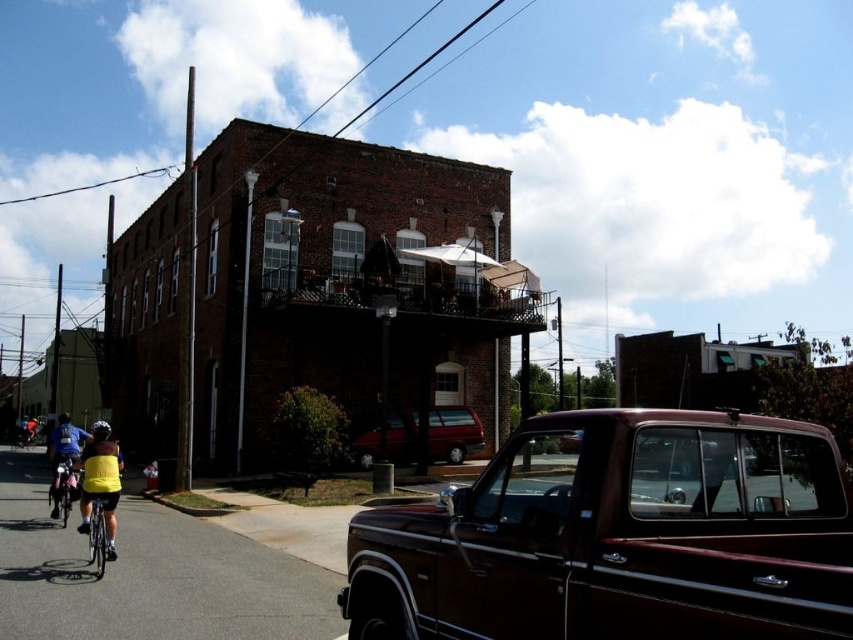
Question: Does metallic maroon truck at lower right appear over shiny silver bicycle at lower left?

Choices:
 (A) no
 (B) yes

Answer: (B)

Question: Does shiny maroon truck at center appear under metallic red minivan at center?

Choices:
 (A) no
 (B) yes

Answer: (A)

Question: Which object appears closest to the camera in this image?

Choices:
 (A) shiny silver bicycle at lower left
 (B) yellow matte bicycle helmet at lower left
 (C) metallic red minivan at center

Answer: (B)

Question: Among these objects, which one is nearest to the camera?

Choices:
 (A) pink matte bicycle at lower left
 (B) shiny maroon truck at center
 (C) metallic maroon truck at lower right

Answer: (B)

Question: Can you confirm if shiny maroon truck at center is thinner than yellow fabric at lower left?

Choices:
 (A) yes
 (B) no

Answer: (A)

Question: Which object is closer to the camera taking this photo?

Choices:
 (A) shiny silver bicycle at lower left
 (B) satin burgundy truck at center
 (C) metallic red minivan at center

Answer: (B)